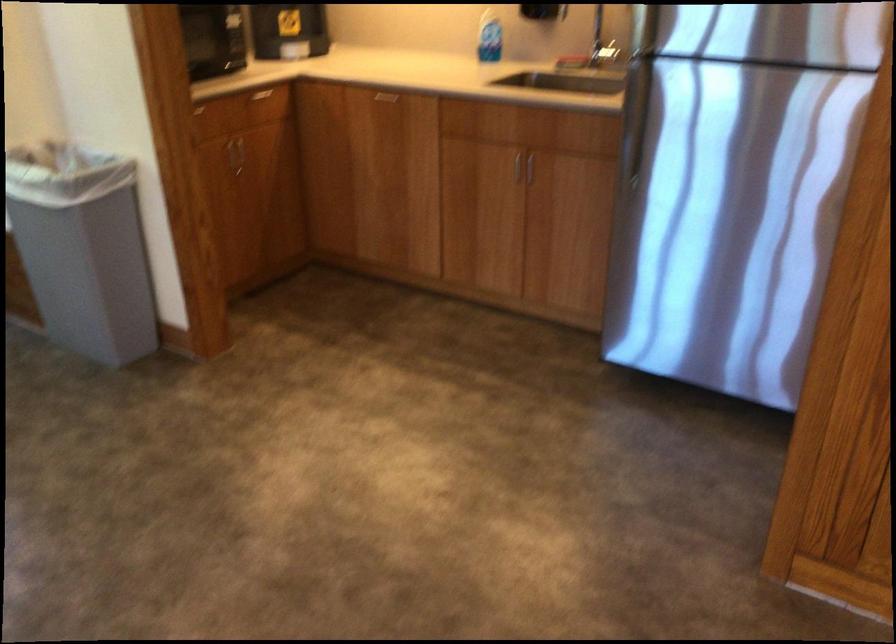
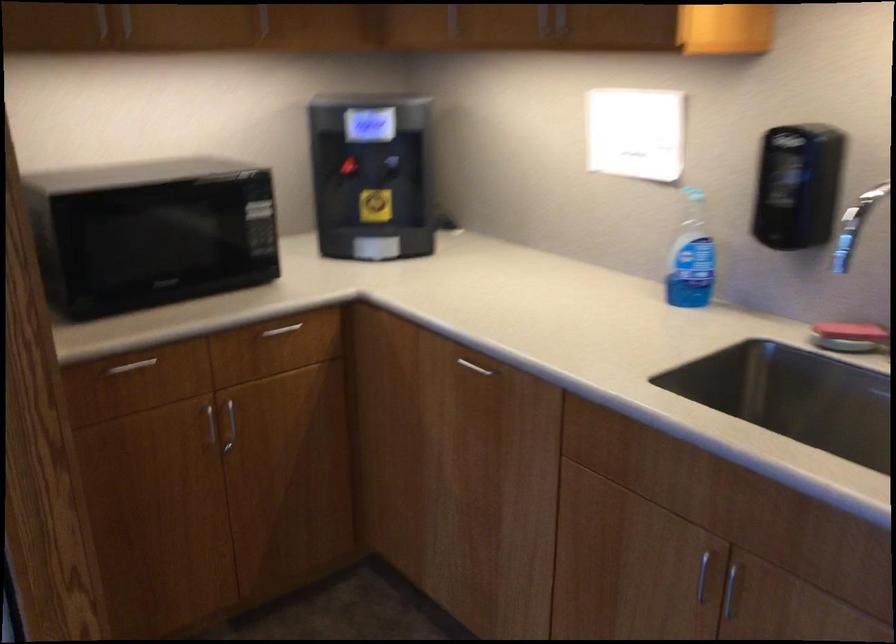
The point at (515, 169) is marked in the first image. Where is the corresponding point in the second image?

(702, 574)